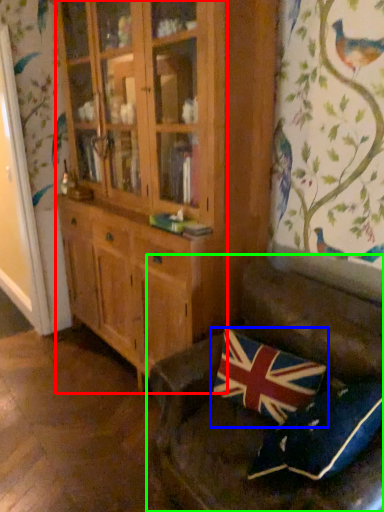
Question: Which is nearer to the cabinetry (highlighted by a red box)? pillow (highlighted by a blue box) or studio couch (highlighted by a green box).

Choices:
 (A) pillow
 (B) studio couch

Answer: (B)